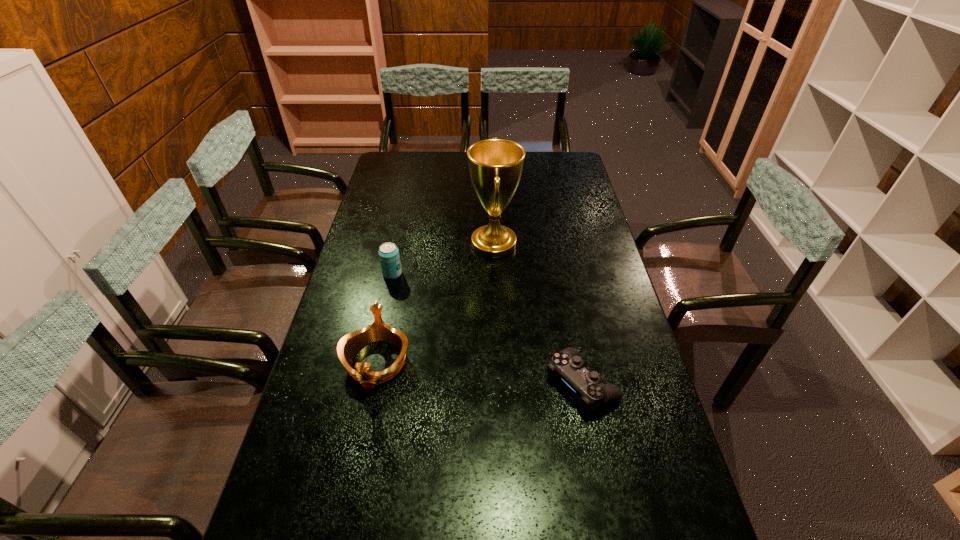
Where is `vacant position located on the front of the beer can`? vacant position located on the front of the beer can is located at coordinates (375, 352).

Find the location of `vacant space positioned on the left of the rightmost object`. vacant space positioned on the left of the rightmost object is located at coordinates (424, 383).

Locate an element on the screen. The image size is (960, 540). tiara present at the left edge is located at coordinates (350, 344).

Identify the location of beer can that is at the left edge. (389, 256).

The width and height of the screenshot is (960, 540). Find the location of `object that is at the right edge`. object that is at the right edge is located at coordinates (567, 365).

Where is `vacant region at the far edge of the desktop`? This screenshot has height=540, width=960. vacant region at the far edge of the desktop is located at coordinates (529, 152).

You are a GUI agent. You are given a task and a screenshot of the screen. Output one action in this format:
    pyautogui.click(x=<x>, y=<y>)
    Task: Click on the vacant area at the left edge of the desktop
    The height and width of the screenshot is (540, 960).
    Given the screenshot: What is the action you would take?
    pyautogui.click(x=327, y=406)

At what (x,y) coordinates should I click in order to perform the action: click on free space at the right edge of the desktop. Please return your answer as a coordinate pair (x, y). Looking at the image, I should click on (568, 245).

Image resolution: width=960 pixels, height=540 pixels. In order to click on vacant area at the far left corner of the desktop in this screenshot , I will do `click(386, 169)`.

Identify the location of unoccupied area between the second object from right to left and the control. This screenshot has width=960, height=540. (538, 314).